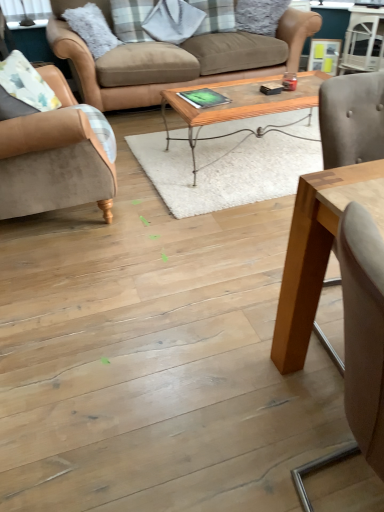
The height and width of the screenshot is (512, 384). I want to click on wooden table at center, arranged as the first coffee table when viewed from the front, so click(x=317, y=250).

Where is `light brown wood swivel chair at right`? The image size is (384, 512). light brown wood swivel chair at right is located at coordinates (359, 343).

Is woodenwoodencoffee table at center, the first coffee table viewed from the back, surrounded by light brown wood swivel chair at right?

That's incorrect, woodenwoodencoffee table at center, the first coffee table viewed from the back, is not inside light brown wood swivel chair at right.

Considering their positions, is light brown wood swivel chair at right located in front of or behind woodenwoodencoffee table at center, placed as the first coffee table when sorted from top to bottom?

light brown wood swivel chair at right is positioned closer to the viewer than woodenwoodencoffee table at center, placed as the first coffee table when sorted from top to bottom.

There is a light brown wood swivel chair at right. Find the location of `the 2nd coffee table above it (from the image's perspective)`. the 2nd coffee table above it (from the image's perspective) is located at coordinates (240, 104).

From a real-world perspective, which object rests below the other?

woodenwoodencoffee table at center, placed as the first coffee table when sorted from top to bottom, is physically lower.

Does brown leather couch at upper center touch woodenwoodencoffee table at center, the first coffee table viewed from the back?

brown leather couch at upper center and woodenwoodencoffee table at center, the first coffee table viewed from the back, are not in contact.

Does brown leather couch at upper center appear on the left side of woodenwoodencoffee table at center, which is the 2th coffee table from bottom to top?

Correct, you'll find brown leather couch at upper center to the left of woodenwoodencoffee table at center, which is the 2th coffee table from bottom to top.

Is brown leather couch at upper center thinner than woodenwoodencoffee table at center, arranged as the second coffee table when viewed from the front?

Incorrect, the width of brown leather couch at upper center is not less than that of woodenwoodencoffee table at center, arranged as the second coffee table when viewed from the front.

From a real-world perspective, is brown leather couch at upper center over woodenwoodencoffee table at center, arranged as the second coffee table when viewed from the front?

Yes.

How different are the orientations of light brown wood swivel chair at right and brown leather couch at upper center in degrees?

The facing directions of light brown wood swivel chair at right and brown leather couch at upper center are 90.9 degrees apart.

From a real-world perspective, is light brown wood swivel chair at right under brown leather couch at upper center?

No, from a real-world perspective, light brown wood swivel chair at right is not below brown leather couch at upper center.

Identify the location of studio couch behind the light brown wood swivel chair at right. (174, 59).

Is light brown wood swivel chair at right wider than brown leather couch at upper center?

In fact, light brown wood swivel chair at right might be narrower than brown leather couch at upper center.

Is suede beige armchair at left next to light brown wood swivel chair at right and touching it?

suede beige armchair at left and light brown wood swivel chair at right are not in contact.

From the image's perspective, is suede beige armchair at left beneath light brown wood swivel chair at right?

No.

Which of these two, suede beige armchair at left or light brown wood swivel chair at right, is bigger?

light brown wood swivel chair at right.

From a real-world perspective, who is located higher, woodenwoodencoffee table at center, the first coffee table viewed from the back, or light brown wood swivel chair at right?

From a 3D spatial view, light brown wood swivel chair at right is above.

Considering the relative sizes of woodenwoodencoffee table at center, placed as the first coffee table when sorted from top to bottom, and light brown wood swivel chair at right in the image provided, is woodenwoodencoffee table at center, placed as the first coffee table when sorted from top to bottom, thinner than light brown wood swivel chair at right?

Incorrect, the width of woodenwoodencoffee table at center, placed as the first coffee table when sorted from top to bottom, is not less than that of light brown wood swivel chair at right.

Who is bigger, woodenwoodencoffee table at center, arranged as the second coffee table when viewed from the front, or light brown wood swivel chair at right?

With larger size is woodenwoodencoffee table at center, arranged as the second coffee table when viewed from the front.

How many degrees apart are the facing directions of woodenwoodencoffee table at center, arranged as the second coffee table when viewed from the front, and light brown wood swivel chair at right?

woodenwoodencoffee table at center, arranged as the second coffee table when viewed from the front, and light brown wood swivel chair at right are facing 91.1 degrees away from each other.

Considering the relative positions of brown leather couch at upper center and suede beige armchair at left in the image provided, is brown leather couch at upper center to the left or to the right of suede beige armchair at left?

brown leather couch at upper center is to the right of suede beige armchair at left.

Is brown leather couch at upper center inside or outside of suede beige armchair at left?

brown leather couch at upper center cannot be found inside suede beige armchair at left.

From the image's perspective, is brown leather couch at upper center on top of suede beige armchair at left?

Yes.

Between brown leather couch at upper center and suede beige armchair at left, which one has larger width?

brown leather couch at upper center is wider.

Does light brown wood swivel chair at right have a greater height compared to suede beige armchair at left?

Yes.

This screenshot has width=384, height=512. I want to click on chair above the light brown wood swivel chair at right (from a real-world perspective), so click(53, 159).

Between light brown wood swivel chair at right and suede beige armchair at left, which one has smaller size?

suede beige armchair at left is smaller.

From a real-world perspective, which object stands above the other?

From a 3D spatial view, suede beige armchair at left is above.

You are a GUI agent. You are given a task and a screenshot of the screen. Output one action in this format:
    pyautogui.click(x=<x>, y=<y>)
    Task: Click on the 2nd coffee table below the light brown wood swivel chair at right (from a real-world perspective)
    The height and width of the screenshot is (512, 384).
    Given the screenshot: What is the action you would take?
    pyautogui.click(x=240, y=104)

Locate an element on the screen. This screenshot has height=512, width=384. studio couch above the woodenwoodencoffee table at center, which is the 2th coffee table from bottom to top (from a real-world perspective) is located at coordinates (174, 59).

Based on their spatial positions, is light brown wood swivel chair at right or woodenwoodencoffee table at center, which is the 2th coffee table from bottom to top, further from brown leather couch at upper center?

The object further to brown leather couch at upper center is light brown wood swivel chair at right.

When comparing their distances from light brown wood swivel chair at right, does wooden table at center, which is the 2th coffee table in back-to-front order, or woodenwoodencoffee table at center, which is the 2th coffee table from bottom to top, seem closer?

Based on the image, wooden table at center, which is the 2th coffee table in back-to-front order, appears to be nearer to light brown wood swivel chair at right.

Based on the photo, based on their spatial positions, is suede beige armchair at left or wooden table at center, arranged as the first coffee table when viewed from the front, further from light brown wood swivel chair at right?

suede beige armchair at left is further to light brown wood swivel chair at right.

Considering their positions, is wooden table at center, which appears as the second coffee table when viewed from the top, positioned further to suede beige armchair at left than woodenwoodencoffee table at center, which is the 2th coffee table from bottom to top?

The object further to suede beige armchair at left is wooden table at center, which appears as the second coffee table when viewed from the top.

Considering their positions, is suede beige armchair at left positioned further to woodenwoodencoffee table at center, which is the 2th coffee table from bottom to top, than brown leather couch at upper center?

suede beige armchair at left.

Considering their positions, is light brown wood swivel chair at right positioned further to wooden table at center, which is the first coffee table from bottom to top, than woodenwoodencoffee table at center, placed as the first coffee table when sorted from top to bottom?

woodenwoodencoffee table at center, placed as the first coffee table when sorted from top to bottom, is further to wooden table at center, which is the first coffee table from bottom to top.

In the scene shown: Based on their spatial positions, is light brown wood swivel chair at right or brown leather couch at upper center closer to suede beige armchair at left?

Among the two, light brown wood swivel chair at right is located nearer to suede beige armchair at left.

Based on their spatial positions, is suede beige armchair at left or woodenwoodencoffee table at center, placed as the first coffee table when sorted from top to bottom, further from light brown wood swivel chair at right?

woodenwoodencoffee table at center, placed as the first coffee table when sorted from top to bottom, is further to light brown wood swivel chair at right.

What are the coordinates of `studio couch between suede beige armchair at left and woodenwoodencoffee table at center, placed as the first coffee table when sorted from top to bottom, in the horizontal direction` in the screenshot? It's located at (174, 59).

Identify the location of coffee table positioned between wooden table at center, which appears as the second coffee table when viewed from the top, and brown leather couch at upper center from near to far. The width and height of the screenshot is (384, 512). (240, 104).

This screenshot has width=384, height=512. In order to click on chair between light brown wood swivel chair at right and brown leather couch at upper center in the front-back direction in this screenshot , I will do `click(53, 159)`.

Identify the location of coffee table between suede beige armchair at left and wooden table at center, which is the first coffee table from bottom to top, from left to right. The height and width of the screenshot is (512, 384). (240, 104).